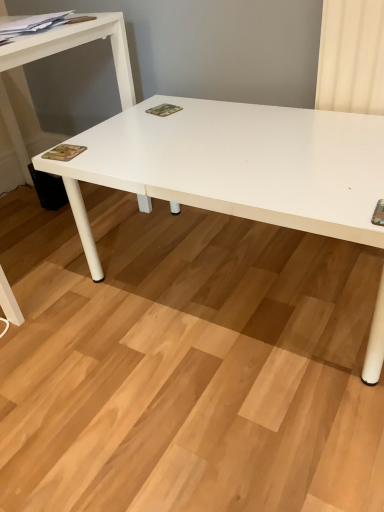
Question: Is camouflage paper at lower left, which appears as the 2th magazine when viewed from the right, inside or outside of camouflage fabric magazine at center, the 2th magazine in the top-to-bottom sequence?

Choices:
 (A) outside
 (B) inside

Answer: (A)

Question: Would you say camouflage paper at lower left, the third magazine when ordered from top to bottom, is to the left or to the right of camouflage fabric magazine at center, placed as the 1th magazine when sorted from right to left, in the picture?

Choices:
 (A) left
 (B) right

Answer: (A)

Question: Estimate the real-world distances between objects in this image. Which object is farther from the white matte table at left?

Choices:
 (A) camouflage fabric magazine at center, the second magazine when ordered from bottom to top
 (B) matte paper magazine at upper left, which is the third magazine from right to left
 (C) camouflage paper at lower left, placed as the second magazine when sorted from left to right

Answer: (C)

Question: Which is farther from the matte paper magazine at upper left, the first magazine positioned from the left?

Choices:
 (A) camouflage paper at lower left, placed as the second magazine when sorted from left to right
 (B) camouflage fabric magazine at center, the second magazine when ordered from bottom to top
 (C) white matte table at left

Answer: (B)